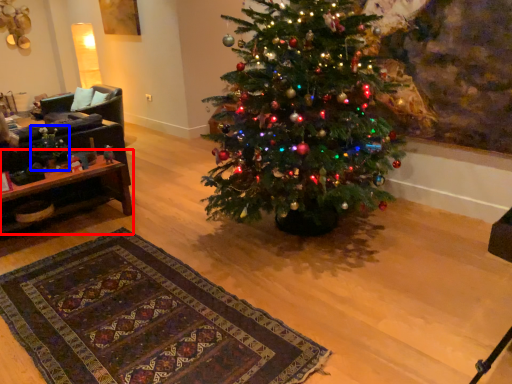
Question: Which of the following is the closest to the observer, table (highlighted by a red box) or christmas decoration (highlighted by a blue box)?

Choices:
 (A) table
 (B) christmas decoration

Answer: (A)